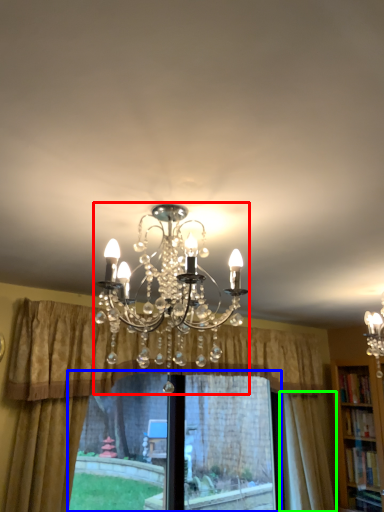
Question: Estimate the real-world distances between objects in this image. Which object is farther from lamp (highlighted by a red box), bay window (highlighted by a blue box) or curtain (highlighted by a green box)?

Choices:
 (A) bay window
 (B) curtain

Answer: (B)